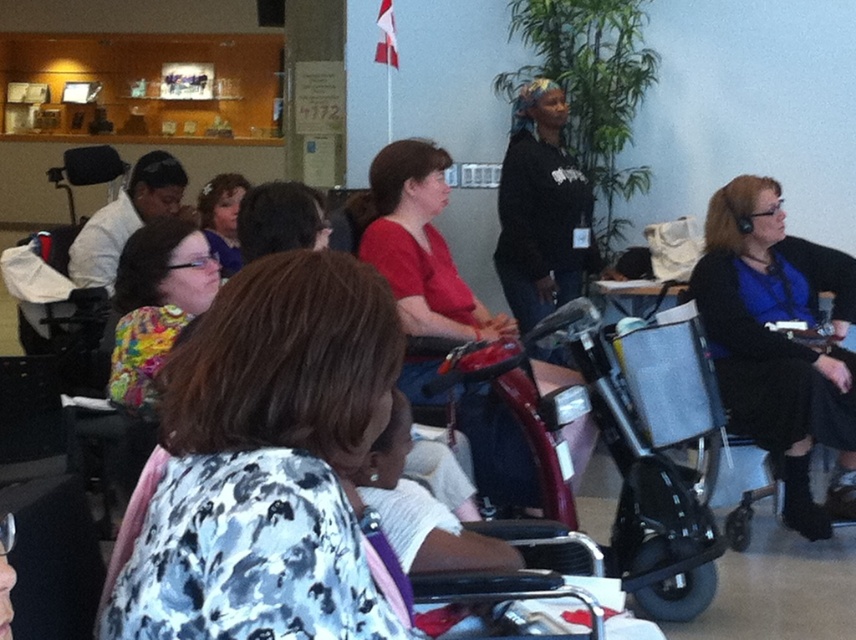
Question: Is floral-patterned blouse at center to the right of floral fabric shirt at left from the viewer's perspective?

Choices:
 (A) no
 (B) yes

Answer: (B)

Question: Among these objects, which one is farthest from the camera?

Choices:
 (A) floral-patterned blouse at center
 (B) matte red scooter at center

Answer: (B)

Question: Is floral-patterned blouse at center to the left of matte red scooter at center from the viewer's perspective?

Choices:
 (A) yes
 (B) no

Answer: (A)

Question: Among these objects, which one is nearest to the camera?

Choices:
 (A) matte black wheelchair at right
 (B) floral fabric shirt at left

Answer: (B)

Question: From the image, what is the correct spatial relationship of floral-patterned blouse at center in relation to matte floral blouse at center?

Choices:
 (A) right
 (B) left

Answer: (A)

Question: Which point is farther to the camera?

Choices:
 (A) (813, 528)
 (B) (318, 310)

Answer: (A)